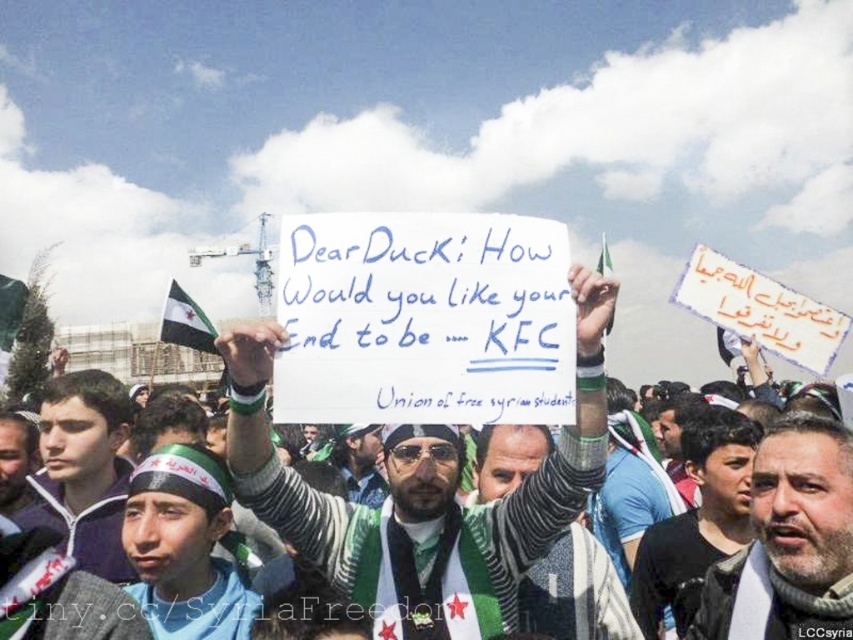
Which is in front, point (292, 486) or point (811, 625)?

Point (811, 625) is in front.

This screenshot has height=640, width=853. What do you see at coordinates (422, 497) in the screenshot?
I see `striped sweater at center` at bounding box center [422, 497].

Where is `striped sweater at center`? striped sweater at center is located at coordinates (422, 497).